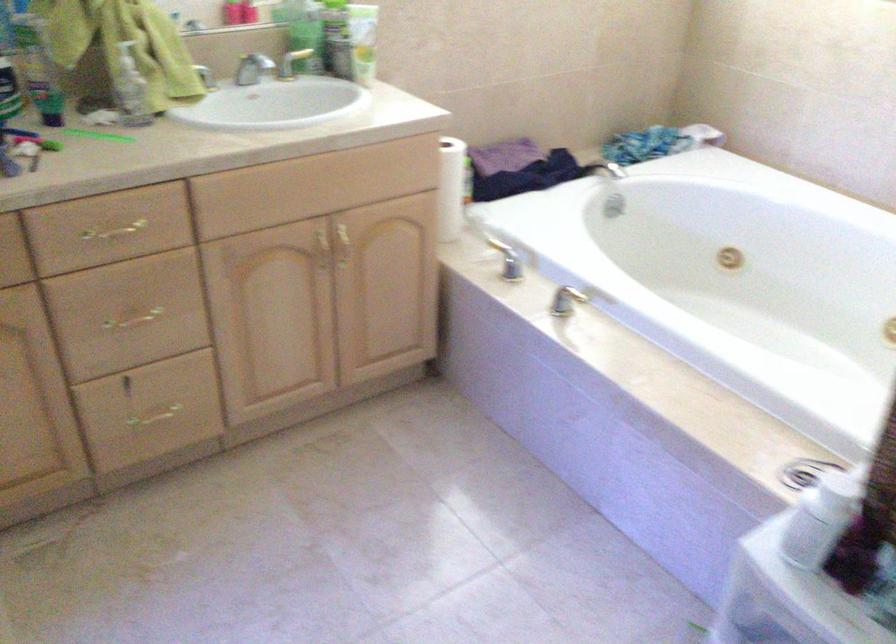
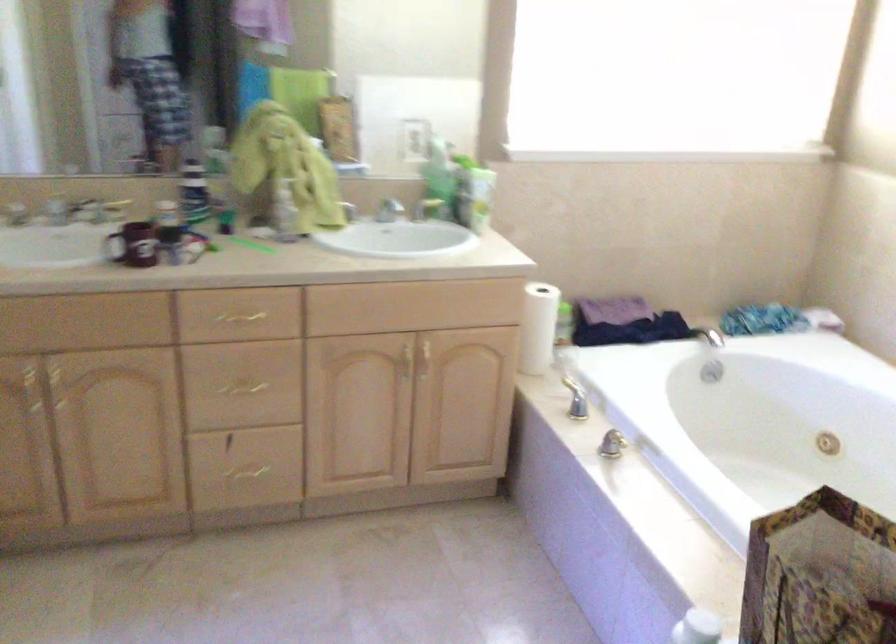
Where in the second image is the point corresponding to [140,310] from the first image?

(247, 382)